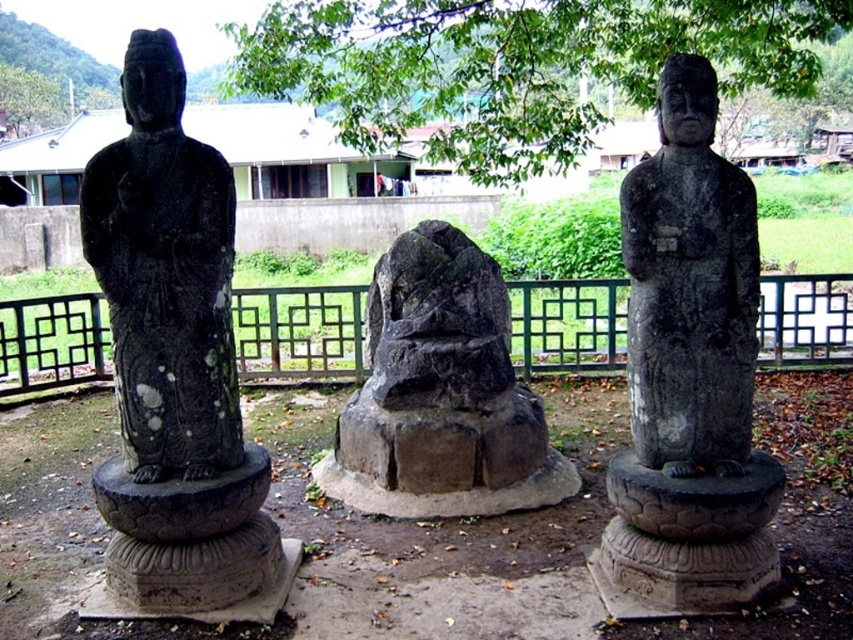
Which of these two, black stone statue at left or black stone lion at center, stands shorter?

Standing shorter between the two is black stone lion at center.

Which is more to the right, black stone statue at left or black stone lion at center?

black stone lion at center

Is point (224, 460) farther from viewer compared to point (338, 486)?

No, (224, 460) is in front of (338, 486).

Find the location of a particular element. black stone statue at left is located at coordinates click(x=173, y=358).

Is point (656, 557) positioned before point (764, 328)?

Yes, point (656, 557) is closer to viewer.

Is black stone statue at center smaller than black metal fence at center?

No.

Identify the location of black stone statue at center. Image resolution: width=853 pixels, height=640 pixels. (689, 371).

The image size is (853, 640). Find the location of `black stone statue at center`. black stone statue at center is located at coordinates (689, 371).

Is black stone lion at center closer to the viewer compared to black metal fence at center?

That is True.

Which of these two, black stone lion at center or black metal fence at center, stands shorter?

black metal fence at center

Image resolution: width=853 pixels, height=640 pixels. Find the location of `black stone lion at center`. black stone lion at center is located at coordinates (440, 394).